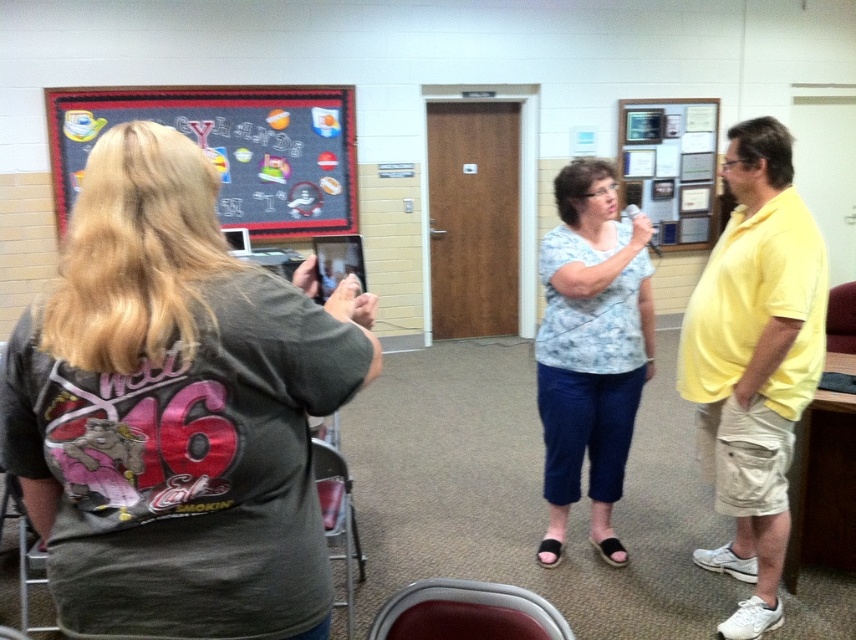
Where is `dark gray t-shirt at left`? The height and width of the screenshot is (640, 856). dark gray t-shirt at left is located at coordinates coord(176,410).

In the scene shown: Is dark gray t-shirt at left thinner than blackboard with stickers at upper left?

Yes.

Which is behind, point (128, 483) or point (355, 228)?

The point (355, 228) is more distant.

This screenshot has width=856, height=640. In order to click on dark gray t-shirt at left in this screenshot , I will do `click(176, 410)`.

From the picture: Which is below, yellow cotton shirt at center or blackboard with stickers at upper left?

Positioned lower is yellow cotton shirt at center.

Which of these two, yellow cotton shirt at center or blackboard with stickers at upper left, stands shorter?

With less height is blackboard with stickers at upper left.

At what (x,y) coordinates should I click in order to perform the action: click on yellow cotton shirt at center. Please return your answer as a coordinate pair (x, y). The width and height of the screenshot is (856, 640). Looking at the image, I should click on (753, 362).

Locate an element on the screen. yellow cotton shirt at center is located at coordinates (753, 362).

Where is `light blue printed blouse at center`? The width and height of the screenshot is (856, 640). light blue printed blouse at center is located at coordinates (590, 349).

Locate an element on the screen. light blue printed blouse at center is located at coordinates [x=590, y=349].